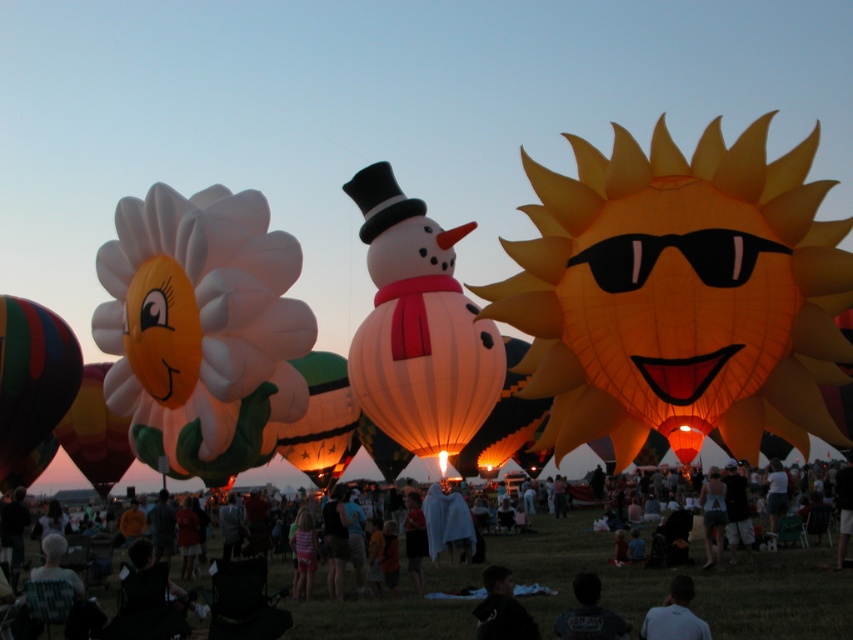
You are standing at the hot air balloon festival and want to reach the point marked as point (200, 307). The festival has a rule that you can only walk up to 100 meters. Can you safely reach that point without exceeding the walking limit?

The point (200, 307) is 132.36 meters away from the viewer, which exceeds the 100 meters walking limit. Therefore, you cannot safely reach that point without breaking the festival rules.

You are an event planner assessing the layout of the hot air balloon festival. You notice two items in the image labeled as the matte black jacket at center and the black fabric at lower center. Which of these two items is shorter in height?

The matte black jacket at center is not as tall as the black fabric at lower center, so the matte black jacket at center is shorter in height.

Looking at this image, you are standing in the grassy field at the hot air balloon festival. You see the multicolored striped hot air balloon at left and the light blue shirt at lower right. Which object is positioned to the left of the other?

The multicolored striped hot air balloon at left is to the left of the light blue shirt at lower right.